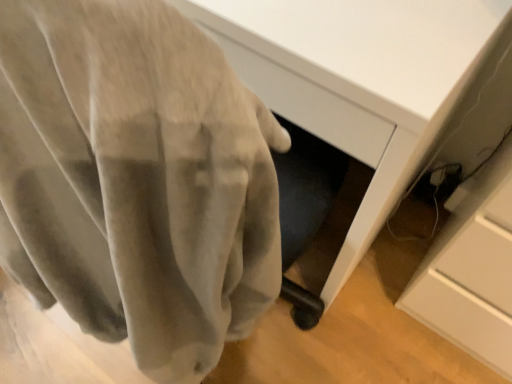
Question: In the image, is velvet gray curtain at center positioned in front of or behind matte white desk at center?

Choices:
 (A) behind
 (B) front

Answer: (B)

Question: In terms of size, does velvet gray curtain at center appear bigger or smaller than matte white desk at center?

Choices:
 (A) big
 (B) small

Answer: (B)

Question: Do you think velvet gray curtain at center is within matte white desk at center, or outside of it?

Choices:
 (A) inside
 (B) outside

Answer: (B)

Question: Considering the positions of matte white desk at center and velvet gray curtain at center in the image, is matte white desk at center bigger or smaller than velvet gray curtain at center?

Choices:
 (A) small
 (B) big

Answer: (B)

Question: Relative to velvet gray curtain at center, is matte white desk at center in front or behind?

Choices:
 (A) behind
 (B) front

Answer: (A)

Question: In terms of width, does matte white desk at center look wider or thinner when compared to velvet gray curtain at center?

Choices:
 (A) wide
 (B) thin

Answer: (A)

Question: From a real-world perspective, is matte white desk at center physically located above or below velvet gray curtain at center?

Choices:
 (A) above
 (B) below

Answer: (B)